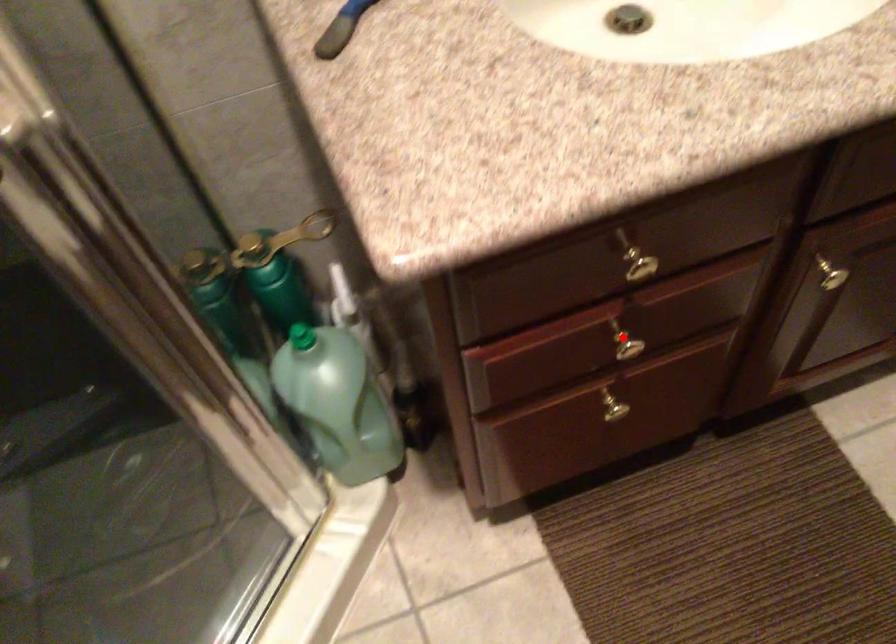
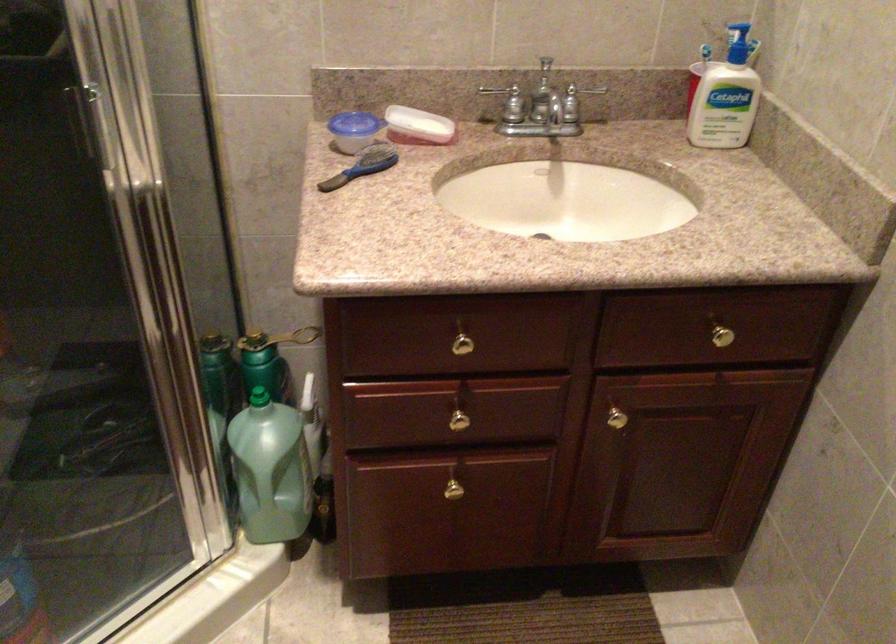
Question: I am providing you with two images of the same scene from different viewpoints. A red point is marked on the first image. Is the red point's position out of view in image 2?

Choices:
 (A) Yes
 (B) No

Answer: (B)